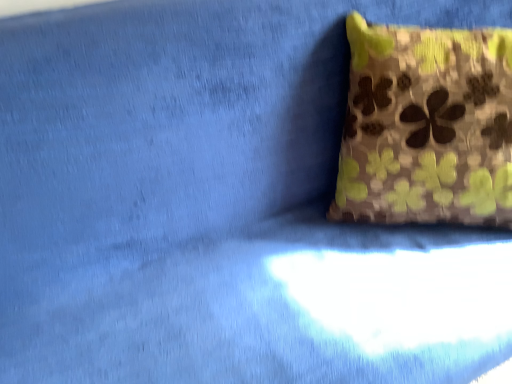
You are a GUI agent. You are given a task and a screenshot of the screen. Output one action in this format:
    pyautogui.click(x=<x>, y=<y>)
    Task: Click on the brown floral fabric pillow at upper right
    The width and height of the screenshot is (512, 384).
    Given the screenshot: What is the action you would take?
    pyautogui.click(x=426, y=126)

What do you see at coordinates (426, 126) in the screenshot? I see `brown floral fabric pillow at upper right` at bounding box center [426, 126].

Where is `brown floral fabric pillow at upper right`? The width and height of the screenshot is (512, 384). brown floral fabric pillow at upper right is located at coordinates (426, 126).